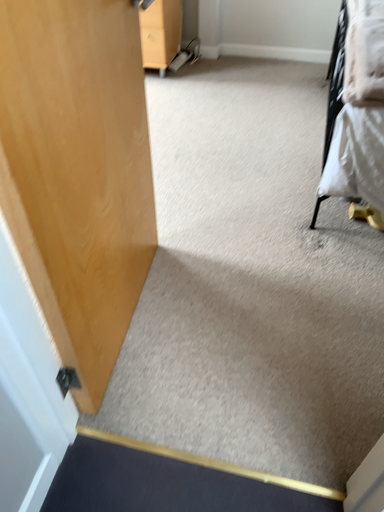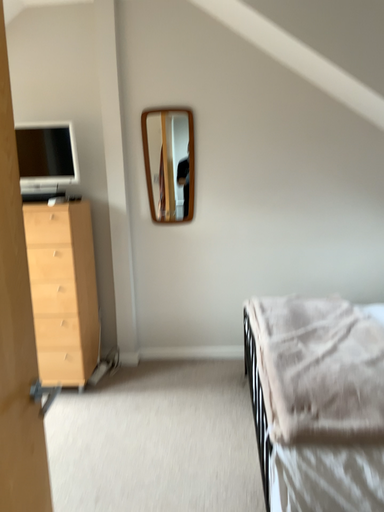
Question: Which way did the camera rotate in the video?

Choices:
 (A) rotated upward
 (B) rotated downward

Answer: (A)